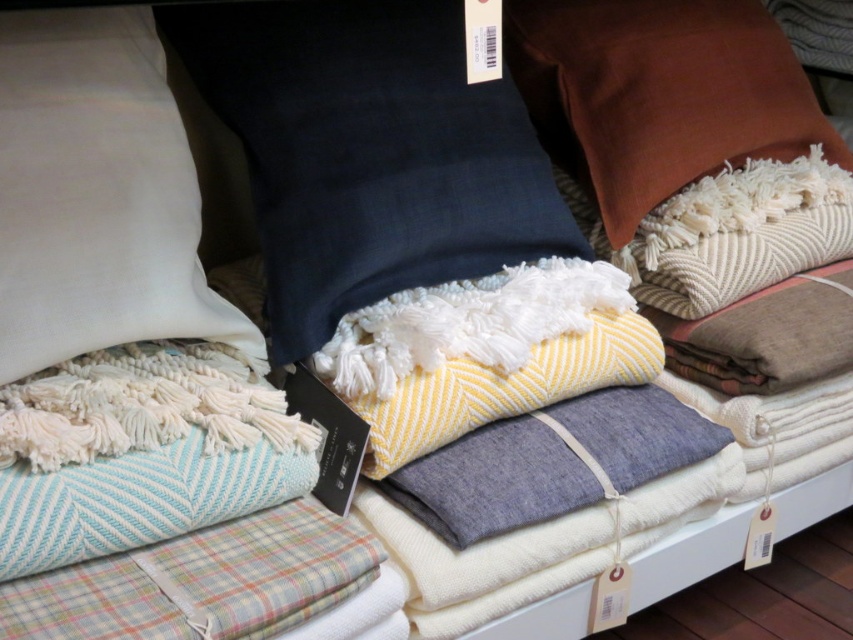
Question: Does navy blue linen pillow at upper center appear on the left side of brown velvet pillow at upper right?

Choices:
 (A) no
 (B) yes

Answer: (B)

Question: Is navy blue linen pillow at upper center below brown velvet pillow at upper right?

Choices:
 (A) yes
 (B) no

Answer: (A)

Question: Is navy blue linen pillow at upper center behind brown velvet pillow at upper right?

Choices:
 (A) no
 (B) yes

Answer: (A)

Question: Which object is positioned closest to the brown velvet pillow at upper right?

Choices:
 (A) white cotton pillow at upper left
 (B) navy blue linen pillow at upper center

Answer: (B)

Question: Which object is closer to the camera taking this photo?

Choices:
 (A) white cotton pillow at upper left
 (B) brown velvet pillow at upper right

Answer: (A)

Question: Which point is closer to the camera?

Choices:
 (A) (320, 282)
 (B) (138, 116)
 (C) (717, 128)

Answer: (B)